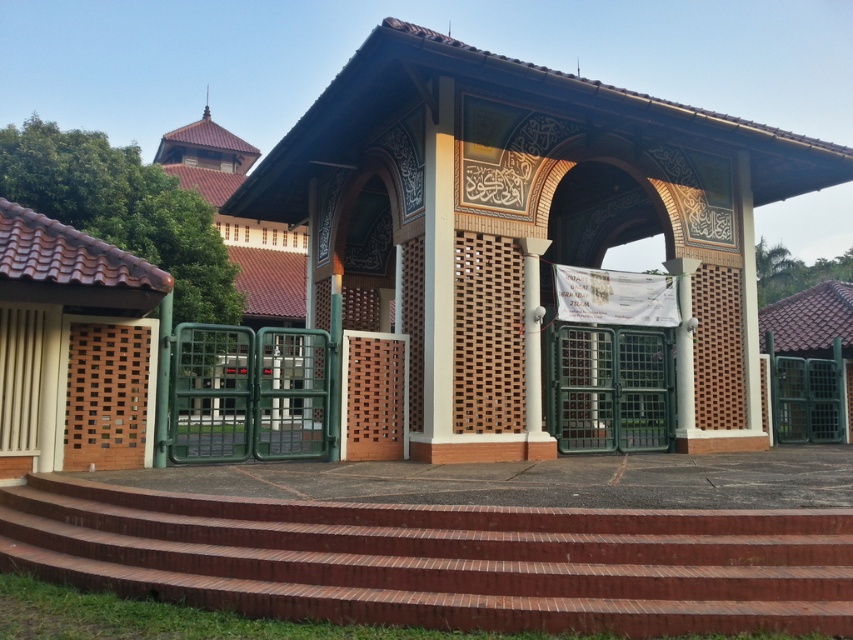
Question: Which point appears closest to the camera in this image?

Choices:
 (A) (378, 145)
 (B) (178, 502)

Answer: (B)

Question: Is brown textured gate at center smaller than red brick stairs at center?

Choices:
 (A) yes
 (B) no

Answer: (B)

Question: Which of the following is the farthest from the observer?

Choices:
 (A) (454, 596)
 (B) (538, 134)

Answer: (B)

Question: Can you confirm if brown textured gate at center is positioned to the left of red brick stairs at center?

Choices:
 (A) yes
 (B) no

Answer: (B)

Question: Does brown textured gate at center have a greater width compared to red brick stairs at center?

Choices:
 (A) yes
 (B) no

Answer: (A)